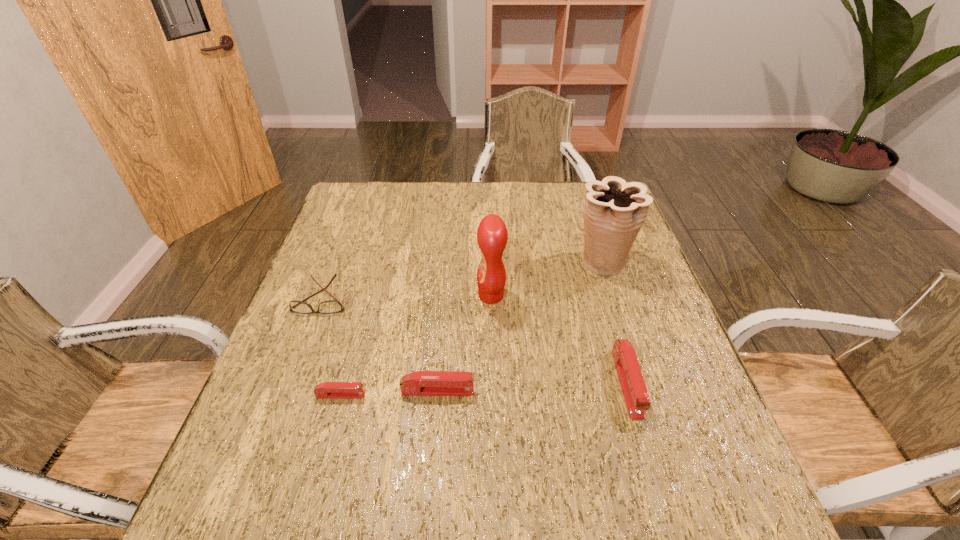
Where is `vacant spot for a new stapler_(stapling_machine) to ensure equal spacing`? vacant spot for a new stapler_(stapling_machine) to ensure equal spacing is located at coordinates (533, 387).